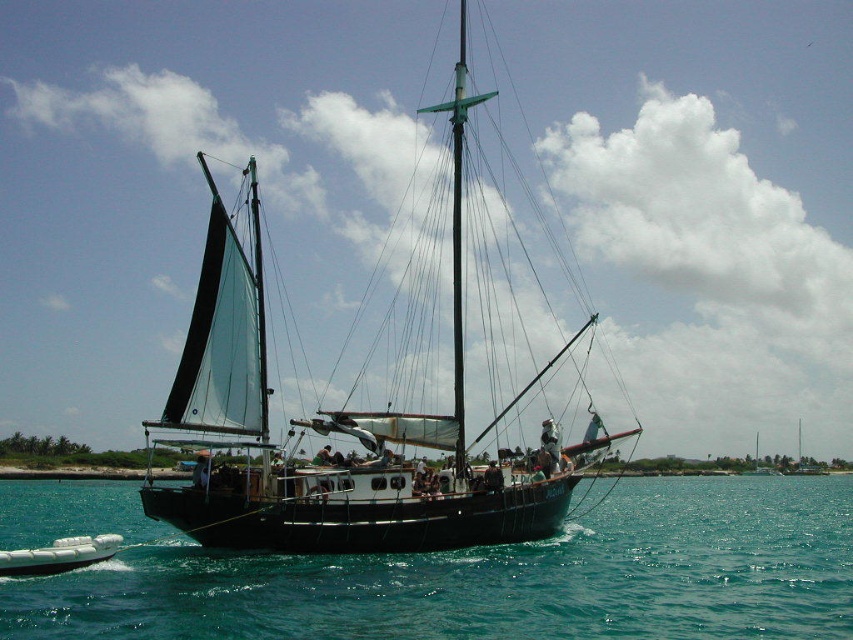
Measure the distance between teal glossy water at center and camera.

teal glossy water at center is 66.91 meters from camera.

Can you confirm if teal glossy water at center is positioned to the left of wooden sailboat at center?

In fact, teal glossy water at center is to the right of wooden sailboat at center.

Is point (126, 493) positioned after point (466, 541)?

Yes, point (126, 493) is behind point (466, 541).

At what (x,y) coordinates should I click in order to perform the action: click on teal glossy water at center. Please return your answer as a coordinate pair (x, y). Looking at the image, I should click on (495, 579).

Which is below, teal glossy water at center or white glossy dinghy at lower left?

teal glossy water at center is lower down.

Does point (120, 620) lie in front of point (83, 564)?

Yes.

Image resolution: width=853 pixels, height=640 pixels. I want to click on teal glossy water at center, so click(495, 579).

Does wooden sailboat at center appear under white glossy dinghy at lower left?

Incorrect, wooden sailboat at center is not positioned below white glossy dinghy at lower left.

Does point (285, 476) lie in front of point (74, 545)?

That is True.

From the picture: Who is more forward, (233, 380) or (61, 563)?

Positioned in front is point (61, 563).

This screenshot has width=853, height=640. Find the location of `wooden sailboat at center`. wooden sailboat at center is located at coordinates (340, 426).